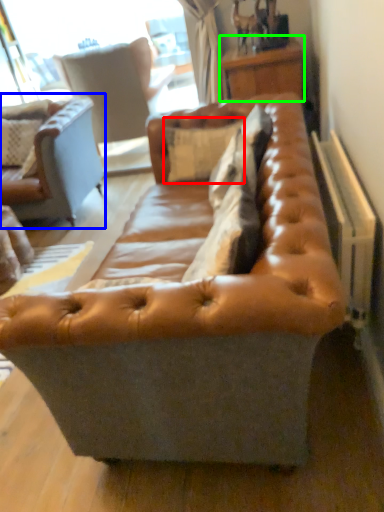
Question: Which object is the farthest from pillow (highlighted by a red box)? Choose among these: studio couch (highlighted by a blue box) or table (highlighted by a green box).

Choices:
 (A) studio couch
 (B) table

Answer: (A)